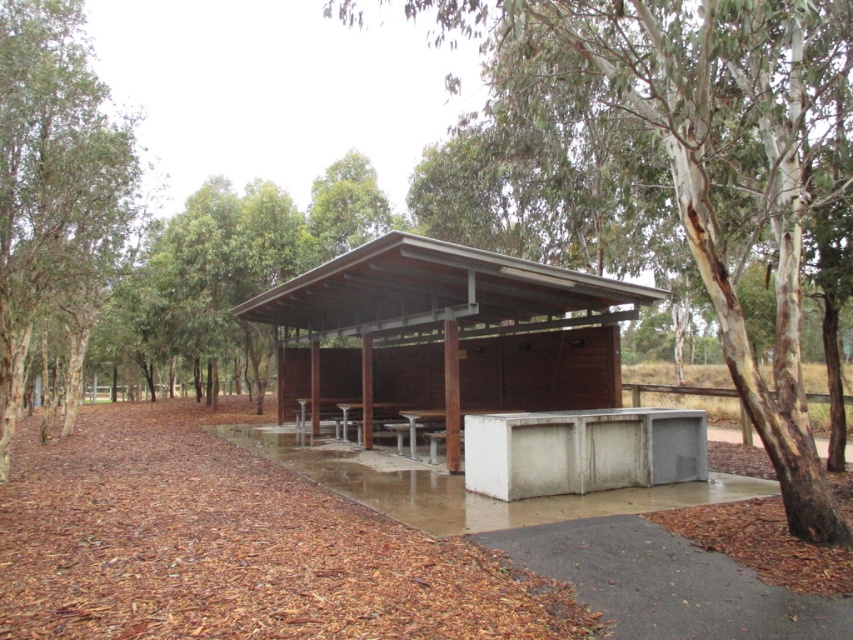
You are planning to set up a tent under the green leafy tree at left for a picnic. Considering the height of the tree and the picnic table, will the tent fit comfortably without touching the metallic silver picnic table at center?

The green leafy tree at left is shorter than the metallic silver picnic table at center, so the tent might not have enough space as the picnic table is taller. It could potentially block the area under the tree.

You are standing at the entrance of the wooden shelter and want to walk towards the point that is closer to you. Which point should you head towards, point (786, 435) or point (546, 362)?

You should head towards point (786, 435) because it is closer to the viewer than point (546, 362).